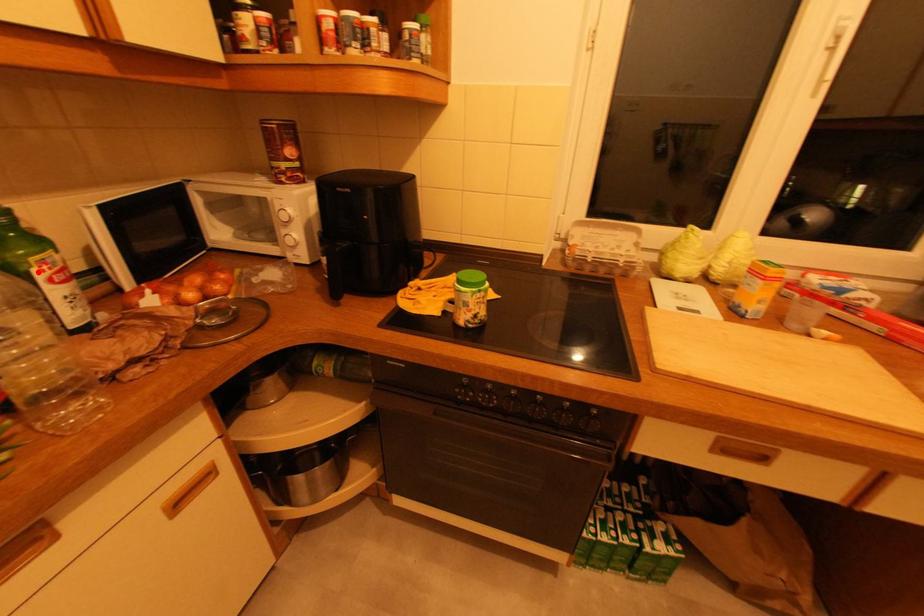
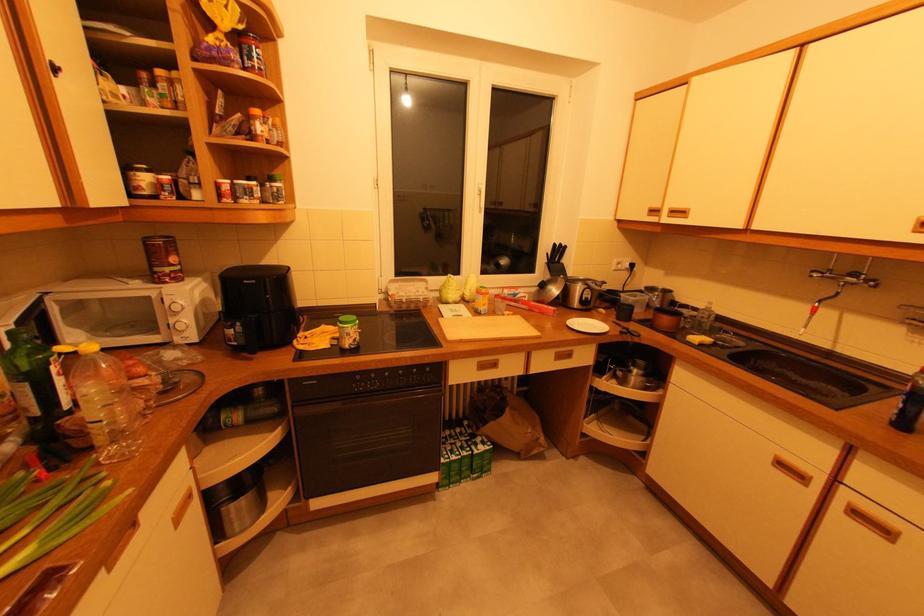
Find the pixel in the second image that matches the highlighted location in the first image.

(55, 368)